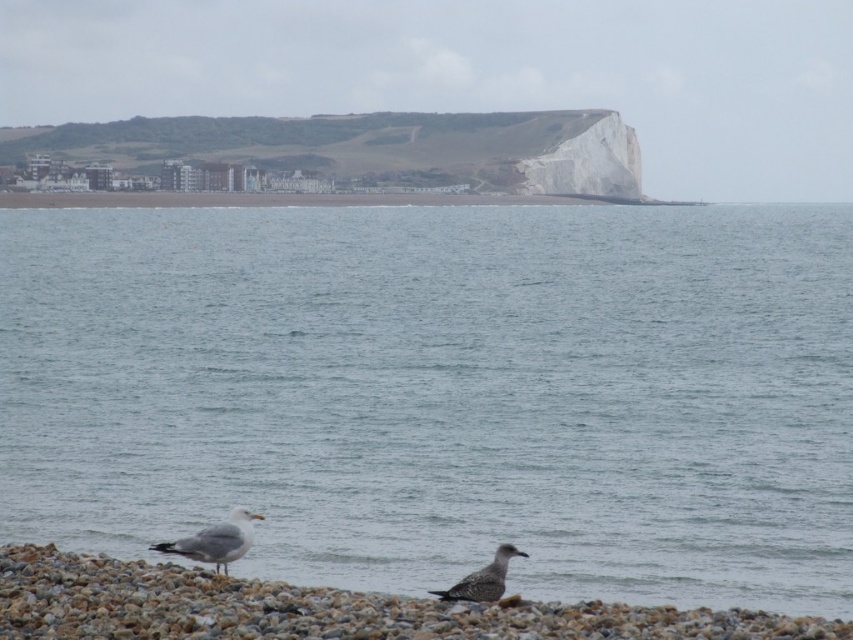
Question: Which point is farther to the camera?

Choices:
 (A) (151, 547)
 (B) (415, 316)
 (C) (488, 582)
 (D) (41, 550)

Answer: (B)

Question: Which point is farther to the camera?

Choices:
 (A) gray matte seagull at lower left
 (B) blue water at center
 (C) speckled feathered bird at lower center

Answer: (A)

Question: Estimate the real-world distances between objects in this image. Which object is farther from the speckled feathered bird at lower center?

Choices:
 (A) gray pebble at lower center
 (B) gray matte seagull at lower left

Answer: (B)

Question: Does blue water at center have a smaller size compared to gray matte seagull at lower left?

Choices:
 (A) no
 (B) yes

Answer: (A)

Question: Is blue water at center above speckled feathered bird at lower center?

Choices:
 (A) no
 (B) yes

Answer: (B)

Question: Can you confirm if gray pebble at lower center is positioned above gray matte seagull at lower left?

Choices:
 (A) yes
 (B) no

Answer: (B)